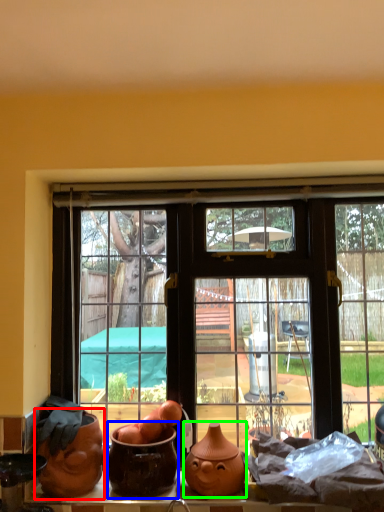
Question: Estimate the real-world distances between objects in this image. Which object is farther from pottery (highlighted by a red box), pottery (highlighted by a blue box) or pottery (highlighted by a green box)?

Choices:
 (A) pottery
 (B) pottery

Answer: (B)